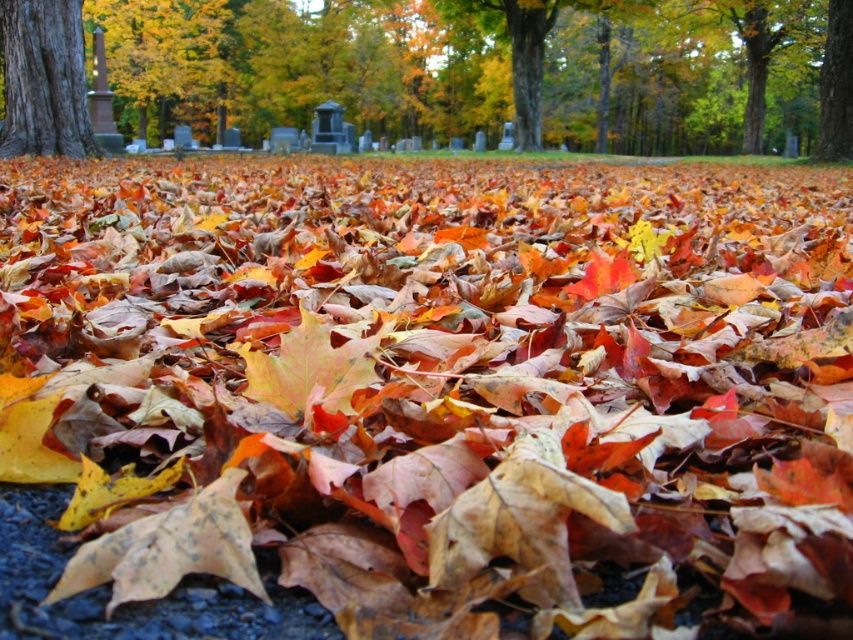
Consider the image. Can you confirm if smooth gray tombstone at center is smaller than smooth brown tree trunk at upper left?

No.

Can you confirm if smooth gray tombstone at center is positioned below smooth brown tree trunk at upper left?

No.

Is point (788, 80) positioned behind point (71, 141)?

Yes.

The height and width of the screenshot is (640, 853). What are the coordinates of `smooth gray tombstone at center` in the screenshot? It's located at (492, 70).

Who is shorter, smooth gray tombstone at center or multicolored paper-like maple leaf at center?

multicolored paper-like maple leaf at center is shorter.

Can you confirm if smooth gray tombstone at center is positioned to the left of multicolored paper-like maple leaf at center?

Incorrect, smooth gray tombstone at center is not on the left side of multicolored paper-like maple leaf at center.

Is point (595, 83) positioned in front of point (320, 342)?

That is False.

Where is `smooth gray tombstone at center`? Image resolution: width=853 pixels, height=640 pixels. smooth gray tombstone at center is located at coordinates (492, 70).

From the picture: Can you confirm if yellowish-brown textured leaf at center is shorter than multicolored paper-like maple leaf at center?

Indeed, yellowish-brown textured leaf at center has a lesser height compared to multicolored paper-like maple leaf at center.

Which is in front, point (198, 563) or point (300, 352)?

Point (198, 563) is in front.

Which is in front, point (67, 584) or point (285, 353)?

Point (67, 584)

Where is `yellowish-brown textured leaf at center`? The width and height of the screenshot is (853, 640). yellowish-brown textured leaf at center is located at coordinates (167, 548).